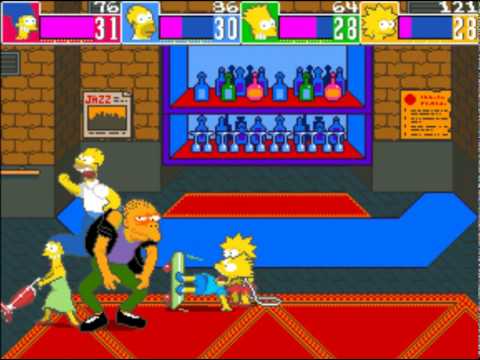
Where is `ventilation panel`? The height and width of the screenshot is (360, 480). ventilation panel is located at coordinates (10, 65).